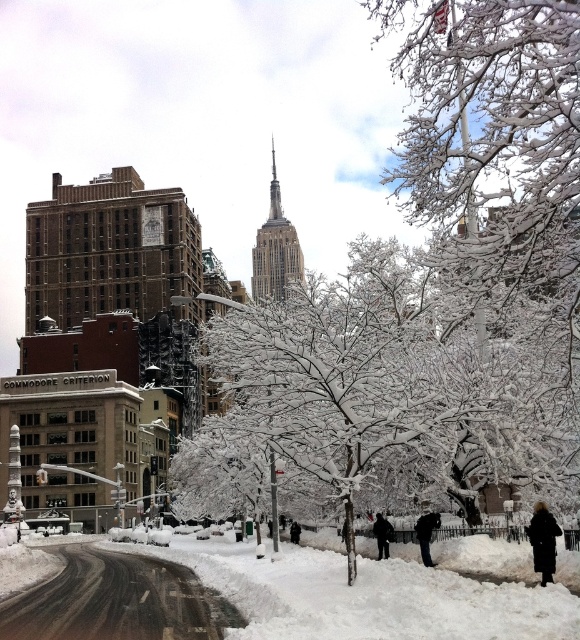
Question: Observing the image, what is the correct spatial positioning of white fluffy snow at lower center in reference to black fabric coat at center?

Choices:
 (A) right
 (B) left

Answer: (B)

Question: Is white fluffy snow at lower center closer to camera compared to black wool coat at lower right?

Choices:
 (A) no
 (B) yes

Answer: (B)

Question: Which object appears closest to the camera in this image?

Choices:
 (A) black wool coat at center
 (B) white snow-covered tree at center

Answer: (B)

Question: Estimate the real-world distances between objects in this image. Which object is farther from the dark gray coat at center?

Choices:
 (A) black wool coat at lower right
 (B) white fluffy snow at lower center
 (C) white snow-covered tree at center

Answer: (C)

Question: Is dark gray coat at center positioned behind black wool coat at center?

Choices:
 (A) no
 (B) yes

Answer: (A)

Question: Which object is positioned farthest from the black wool coat at center?

Choices:
 (A) black fabric coat at center
 (B) dark gray coat at center

Answer: (A)